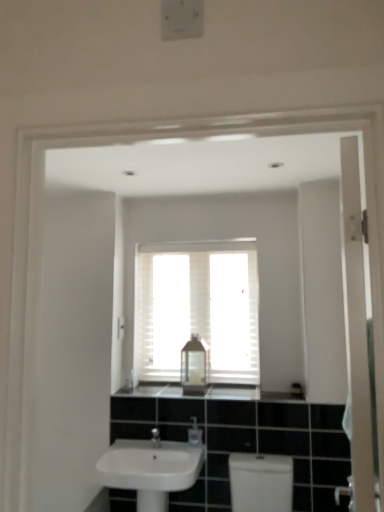
Question: From a real-world perspective, is black granite countertop at center above or below clear plastic soap dispenser at center?

Choices:
 (A) below
 (B) above

Answer: (B)

Question: Is black granite countertop at center wider or thinner than clear plastic soap dispenser at center?

Choices:
 (A) thin
 (B) wide

Answer: (B)

Question: Considering the real-world distances, which object is farthest from the black granite countertop at center?

Choices:
 (A) clear plastic soap dispenser at center
 (B) white matte window at center
 (C) white glossy toilet at lower center
 (D) white glossy door at right
 (E) transparent plastic bottle at center

Answer: (D)

Question: Estimate the real-world distances between objects in this image. Which object is closer to the transparent plastic bottle at center?

Choices:
 (A) white plastic light switch at upper center
 (B) clear plastic soap dispenser at center
 (C) white glossy door at right
 (D) black granite countertop at center
 (E) white glossy sink at lower center

Answer: (D)